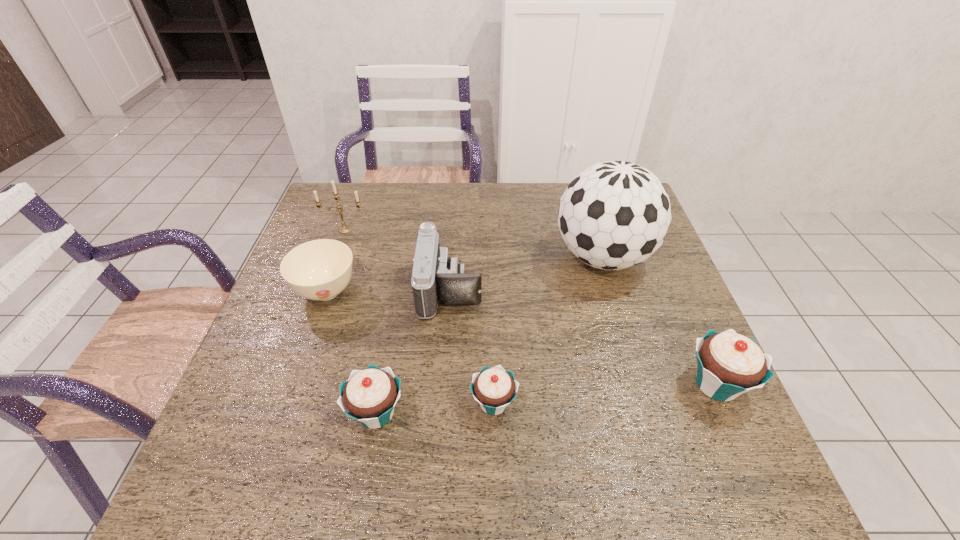
At what (x,y) coordinates should I click in order to perform the action: click on unoccupied position between the sugar bowl and the shortest cupcake. Please return your answer as a coordinate pair (x, y). The height and width of the screenshot is (540, 960). Looking at the image, I should click on (410, 347).

Locate an element on the screen. Image resolution: width=960 pixels, height=540 pixels. free spot between the candle and the camera is located at coordinates (397, 259).

This screenshot has height=540, width=960. I want to click on free point between the camera and the sugar bowl, so pos(389,291).

I want to click on free spot between the tallest cupcake and the tallest object, so click(660, 321).

Locate an element on the screen. The height and width of the screenshot is (540, 960). the fifth closest object to the tallest cupcake is located at coordinates (319, 270).

The height and width of the screenshot is (540, 960). In order to click on object that is the fifth closest one to the leftmost cupcake in this screenshot , I will do `click(343, 229)`.

The image size is (960, 540). What are the coordinates of `the closest cupcake to the sugar bowl` in the screenshot? It's located at (369, 396).

This screenshot has width=960, height=540. Identify the location of cupcake that is the second nearest to the shortest cupcake. (728, 364).

This screenshot has width=960, height=540. Identify the location of free space that satisfies the following two spatial constraints: 1. on the back side of the second shortest cupcake; 2. on the right side of the second cupcake from right to left. (378, 403).

The image size is (960, 540). In order to click on vacant area in the image that satisfies the following two spatial constraints: 1. on the back side of the second cupcake from right to left; 2. on the left side of the tallest cupcake in this screenshot , I will do `click(493, 384)`.